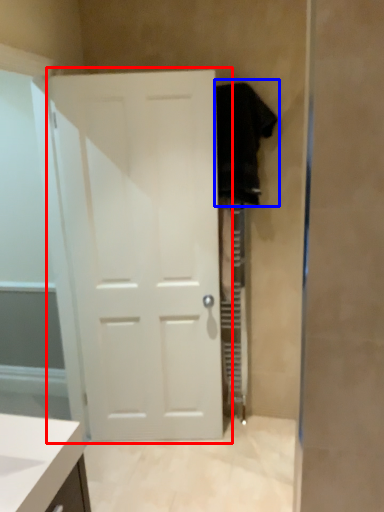
Question: Among these objects, which one is farthest to the camera, door (highlighted by a red box) or robe (highlighted by a blue box)?

Choices:
 (A) door
 (B) robe

Answer: (B)